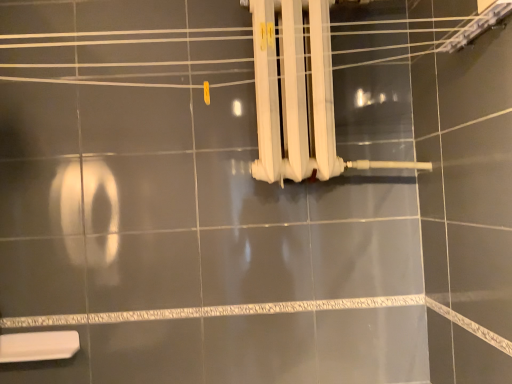
Question: Does white plastic toilet at lower left come behind white plastic radiator at upper right?

Choices:
 (A) no
 (B) yes

Answer: (B)

Question: Is there a large distance between white plastic toilet at lower left and white plastic radiator at upper right?

Choices:
 (A) yes
 (B) no

Answer: (A)

Question: From the image's perspective, is white plastic toilet at lower left on white plastic radiator at upper right?

Choices:
 (A) yes
 (B) no

Answer: (B)

Question: Is white plastic toilet at lower left next to white plastic radiator at upper right?

Choices:
 (A) no
 (B) yes

Answer: (A)

Question: Would you say white plastic radiator at upper right is part of white plastic toilet at lower left's contents?

Choices:
 (A) yes
 (B) no

Answer: (B)

Question: Is white plastic toilet at lower left facing away from white plastic radiator at upper right?

Choices:
 (A) yes
 (B) no

Answer: (B)

Question: Is white plastic radiator at upper right outside white plastic toilet at lower left?

Choices:
 (A) no
 (B) yes

Answer: (B)

Question: Considering the relative sizes of white plastic radiator at upper right and white plastic toilet at lower left in the image provided, is white plastic radiator at upper right thinner than white plastic toilet at lower left?

Choices:
 (A) no
 (B) yes

Answer: (A)

Question: Is white plastic radiator at upper right looking in the opposite direction of white plastic toilet at lower left?

Choices:
 (A) yes
 (B) no

Answer: (B)

Question: Considering the relative sizes of white plastic radiator at upper right and white plastic toilet at lower left in the image provided, is white plastic radiator at upper right taller than white plastic toilet at lower left?

Choices:
 (A) no
 (B) yes

Answer: (B)

Question: Considering the relative sizes of white plastic radiator at upper right and white plastic toilet at lower left in the image provided, is white plastic radiator at upper right smaller than white plastic toilet at lower left?

Choices:
 (A) no
 (B) yes

Answer: (A)

Question: Does white plastic radiator at upper right appear on the left side of white plastic toilet at lower left?

Choices:
 (A) yes
 (B) no

Answer: (B)

Question: Looking at the image, does white plastic toilet at lower left seem bigger or smaller compared to white plastic radiator at upper right?

Choices:
 (A) small
 (B) big

Answer: (A)